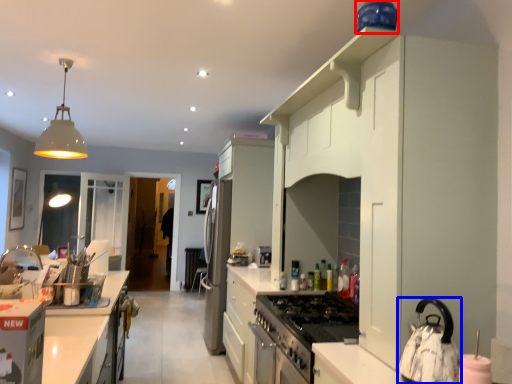
Question: Among these objects, which one is farthest to the camera, appliance (highlighted by a red box) or kitchen appliance (highlighted by a blue box)?

Choices:
 (A) appliance
 (B) kitchen appliance

Answer: (A)